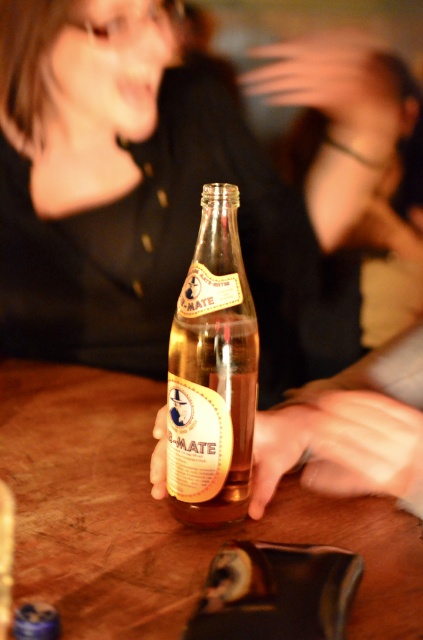
From the picture: Can you confirm if matte glass bottle at center is positioned above wooden table at center?

Yes.

Who is more distant from viewer, (95,8) or (140,387)?

The point (95,8) is more distant.

The height and width of the screenshot is (640, 423). What are the coordinates of `matte glass bottle at center` in the screenshot? It's located at (176, 186).

Which of these two, wooden table at center or translucent glass bottle at center, stands taller?

translucent glass bottle at center

Can you confirm if wooden table at center is taller than translucent glass bottle at center?

No.

Is point (134, 552) behind point (244, 282)?

No, it is not.

This screenshot has height=640, width=423. I want to click on wooden table at center, so click(159, 515).

Does point (74, 253) come closer to viewer compared to point (235, 220)?

No, (74, 253) is further to viewer.

This screenshot has height=640, width=423. Find the location of `matte glass bottle at center`. matte glass bottle at center is located at coordinates (176, 186).

Locate an element on the screen. Image resolution: width=423 pixels, height=640 pixels. matte glass bottle at center is located at coordinates (176, 186).